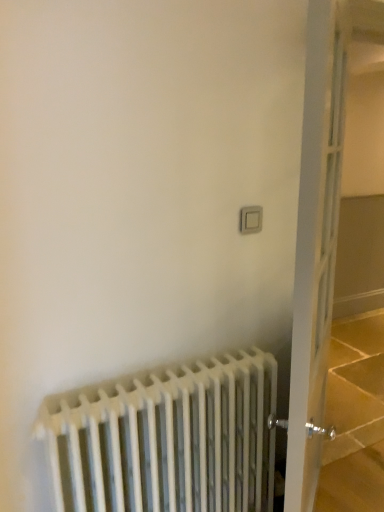
Question: Is white plastic switch at upper right thinner than white metal radiator at lower left?

Choices:
 (A) no
 (B) yes

Answer: (B)

Question: Does white plastic switch at upper right contain white metal radiator at lower left?

Choices:
 (A) yes
 (B) no

Answer: (B)

Question: From the image's perspective, is white plastic switch at upper right over white metal radiator at lower left?

Choices:
 (A) no
 (B) yes

Answer: (B)

Question: Considering the relative sizes of white plastic switch at upper right and white metal radiator at lower left in the image provided, is white plastic switch at upper right taller than white metal radiator at lower left?

Choices:
 (A) no
 (B) yes

Answer: (A)

Question: From a real-world perspective, is white plastic switch at upper right located beneath white metal radiator at lower left?

Choices:
 (A) no
 (B) yes

Answer: (A)

Question: Considering the positions of point (243, 220) and point (66, 407), is point (243, 220) closer or farther from the camera than point (66, 407)?

Choices:
 (A) closer
 (B) farther

Answer: (B)

Question: Looking at their shapes, would you say white plastic switch at upper right is wider or thinner than white metal radiator at lower left?

Choices:
 (A) thin
 (B) wide

Answer: (A)

Question: From the image's perspective, is white plastic switch at upper right positioned above or below white metal radiator at lower left?

Choices:
 (A) below
 (B) above

Answer: (B)

Question: Is white plastic switch at upper right spatially inside white metal radiator at lower left, or outside of it?

Choices:
 (A) inside
 (B) outside

Answer: (B)

Question: From the image's perspective, is white glass door at right positioned above or below white plastic switch at upper right?

Choices:
 (A) below
 (B) above

Answer: (A)

Question: Looking at the image, does white glass door at right seem bigger or smaller compared to white plastic switch at upper right?

Choices:
 (A) small
 (B) big

Answer: (B)

Question: From a real-world perspective, relative to white plastic switch at upper right, is white glass door at right vertically above or below?

Choices:
 (A) above
 (B) below

Answer: (B)

Question: Considering the positions of white glass door at right and white plastic switch at upper right in the image, is white glass door at right taller or shorter than white plastic switch at upper right?

Choices:
 (A) short
 (B) tall

Answer: (B)

Question: From a real-world perspective, relative to white glass door at right, is white metal radiator at lower left vertically above or below?

Choices:
 (A) above
 (B) below

Answer: (B)

Question: From the image's perspective, is white metal radiator at lower left positioned above or below white glass door at right?

Choices:
 (A) below
 (B) above

Answer: (A)